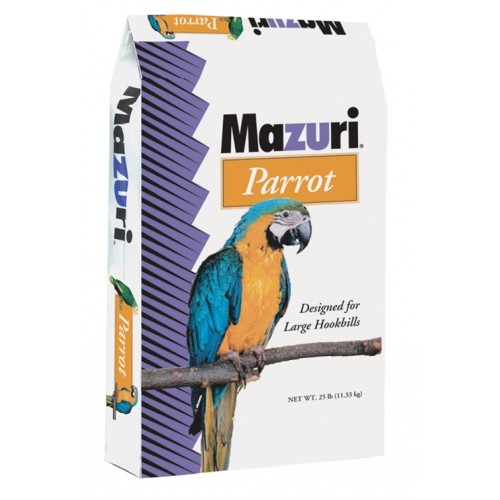
This screenshot has height=500, width=500. Identify the location of table. (279, 494).